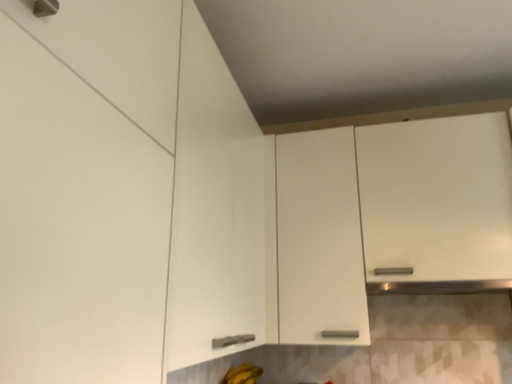
At what (x,y) coordinates should I click in order to perform the action: click on white matte cabinet at upper right, placed as the 1th cabinetry when sorted from right to left. Please return your answer as a coordinate pair (x, y). This screenshot has width=512, height=384. Looking at the image, I should click on (388, 215).

Locate an element on the screen. white matte cabinet at upper right, acting as the 2th cabinetry starting from the left is located at coordinates (388, 215).

Is white matte cabinet at lower left, the second cabinetry in the right-to-left sequence, directly adjacent to yellow matte bananas at lower center?

No, white matte cabinet at lower left, the second cabinetry in the right-to-left sequence, is not making contact with yellow matte bananas at lower center.

Which object is thinner, white matte cabinet at lower left, the 1th cabinetry when ordered from left to right, or yellow matte bananas at lower center?

Thinner between the two is yellow matte bananas at lower center.

Is white matte cabinet at lower left, the second cabinetry in the right-to-left sequence, bigger than yellow matte bananas at lower center?

Yes.

Does white matte cabinet at lower left, the second cabinetry in the right-to-left sequence, have a lesser height compared to yellow matte bananas at lower center?

No, white matte cabinet at lower left, the second cabinetry in the right-to-left sequence, is not shorter than yellow matte bananas at lower center.

Between white matte cabinet at upper right, acting as the 2th cabinetry starting from the left, and yellow matte bananas at lower center, which one has larger width?

Wider between the two is white matte cabinet at upper right, acting as the 2th cabinetry starting from the left.

Considering the relative sizes of white matte cabinet at upper right, placed as the 1th cabinetry when sorted from right to left, and yellow matte bananas at lower center in the image provided, is white matte cabinet at upper right, placed as the 1th cabinetry when sorted from right to left, taller than yellow matte bananas at lower center?

Correct, white matte cabinet at upper right, placed as the 1th cabinetry when sorted from right to left, is much taller as yellow matte bananas at lower center.

From the image's perspective, is white matte cabinet at upper right, acting as the 2th cabinetry starting from the left, below yellow matte bananas at lower center?

No, from the image's perspective, white matte cabinet at upper right, acting as the 2th cabinetry starting from the left, is not below yellow matte bananas at lower center.

Which is closer, [284,319] or [240,375]?

The point [284,319] is closer to the camera.

From the image's perspective, relative to white matte cabinet at upper right, acting as the 2th cabinetry starting from the left, is white matte cabinet at lower left, the second cabinetry in the right-to-left sequence, above or below?

Clearly, from the image's perspective, white matte cabinet at lower left, the second cabinetry in the right-to-left sequence, is above white matte cabinet at upper right, acting as the 2th cabinetry starting from the left.

From a real-world perspective, which is physically below, white matte cabinet at lower left, the second cabinetry in the right-to-left sequence, or white matte cabinet at upper right, acting as the 2th cabinetry starting from the left?

white matte cabinet at lower left, the second cabinetry in the right-to-left sequence, is physically lower.

What's the angular difference between white matte cabinet at lower left, the 1th cabinetry when ordered from left to right, and white matte cabinet at upper right, acting as the 2th cabinetry starting from the left,'s facing directions?

There is a 0.0119-degree angle between the facing directions of white matte cabinet at lower left, the 1th cabinetry when ordered from left to right, and white matte cabinet at upper right, acting as the 2th cabinetry starting from the left.

Considering the relative sizes of white matte cabinet at lower left, the 1th cabinetry when ordered from left to right, and white matte cabinet at upper right, acting as the 2th cabinetry starting from the left, in the image provided, is white matte cabinet at lower left, the 1th cabinetry when ordered from left to right, taller than white matte cabinet at upper right, acting as the 2th cabinetry starting from the left,?

No, white matte cabinet at lower left, the 1th cabinetry when ordered from left to right, is not taller than white matte cabinet at upper right, acting as the 2th cabinetry starting from the left.

Could you tell me if yellow matte bananas at lower center is turned towards white matte cabinet at upper right, acting as the 2th cabinetry starting from the left?

No, yellow matte bananas at lower center is not oriented towards white matte cabinet at upper right, acting as the 2th cabinetry starting from the left.

Is there a large distance between yellow matte bananas at lower center and white matte cabinet at upper right, acting as the 2th cabinetry starting from the left?

No, yellow matte bananas at lower center is not far away from white matte cabinet at upper right, acting as the 2th cabinetry starting from the left.

In the image, is yellow matte bananas at lower center on the left side or the right side of white matte cabinet at upper right, acting as the 2th cabinetry starting from the left?

Clearly, yellow matte bananas at lower center is on the left of white matte cabinet at upper right, acting as the 2th cabinetry starting from the left, in the image.

Is yellow matte bananas at lower center behind white matte cabinet at upper right, acting as the 2th cabinetry starting from the left?

That is True.

Looking at the image, does yellow matte bananas at lower center seem bigger or smaller compared to white matte cabinet at lower left, the second cabinetry in the right-to-left sequence?

yellow matte bananas at lower center is smaller than white matte cabinet at lower left, the second cabinetry in the right-to-left sequence.

Considering the relative positions of yellow matte bananas at lower center and white matte cabinet at lower left, the second cabinetry in the right-to-left sequence, in the image provided, is yellow matte bananas at lower center to the left of white matte cabinet at lower left, the second cabinetry in the right-to-left sequence, from the viewer's perspective?

In fact, yellow matte bananas at lower center is to the right of white matte cabinet at lower left, the second cabinetry in the right-to-left sequence.

Who is taller, yellow matte bananas at lower center or white matte cabinet at lower left, the second cabinetry in the right-to-left sequence?

white matte cabinet at lower left, the second cabinetry in the right-to-left sequence.

Identify the location of the 2nd cabinetry above the yellow matte bananas at lower center (from the image's perspective). This screenshot has width=512, height=384. (86, 188).

How many degrees apart are the facing directions of white matte cabinet at upper right, acting as the 2th cabinetry starting from the left, and white matte cabinet at lower left, the second cabinetry in the right-to-left sequence?

The angle between the facing direction of white matte cabinet at upper right, acting as the 2th cabinetry starting from the left, and the facing direction of white matte cabinet at lower left, the second cabinetry in the right-to-left sequence, is 0.0119 degrees.

Considering the sizes of objects white matte cabinet at upper right, acting as the 2th cabinetry starting from the left, and white matte cabinet at lower left, the second cabinetry in the right-to-left sequence, in the image provided, who is wider, white matte cabinet at upper right, acting as the 2th cabinetry starting from the left, or white matte cabinet at lower left, the second cabinetry in the right-to-left sequence,?

white matte cabinet at lower left, the second cabinetry in the right-to-left sequence.

Is white matte cabinet at lower left, the second cabinetry in the right-to-left sequence, at the back of white matte cabinet at upper right, acting as the 2th cabinetry starting from the left?

No, white matte cabinet at upper right, acting as the 2th cabinetry starting from the left,'s orientation is not away from white matte cabinet at lower left, the second cabinetry in the right-to-left sequence.

Is white matte cabinet at upper right, placed as the 1th cabinetry when sorted from right to left, spatially inside white matte cabinet at lower left, the 1th cabinetry when ordered from left to right, or outside of it?

white matte cabinet at upper right, placed as the 1th cabinetry when sorted from right to left, is not inside white matte cabinet at lower left, the 1th cabinetry when ordered from left to right, it's outside.

Starting from the yellow matte bananas at lower center, which cabinetry is the 2nd one in front? Please provide its 2D coordinates.

[(86, 188)]

Where is `cabinetry on the right side of yellow matte bananas at lower center`? The height and width of the screenshot is (384, 512). cabinetry on the right side of yellow matte bananas at lower center is located at coordinates (388, 215).

Looking at the image, which one is located further to white matte cabinet at lower left, the second cabinetry in the right-to-left sequence, white matte cabinet at upper right, acting as the 2th cabinetry starting from the left, or yellow matte bananas at lower center?

yellow matte bananas at lower center is further to white matte cabinet at lower left, the second cabinetry in the right-to-left sequence.

From the image, which object appears to be nearer to yellow matte bananas at lower center, white matte cabinet at upper right, acting as the 2th cabinetry starting from the left, or white matte cabinet at lower left, the second cabinetry in the right-to-left sequence?

white matte cabinet at upper right, acting as the 2th cabinetry starting from the left, lies closer to yellow matte bananas at lower center than the other object.

Considering their positions, is white matte cabinet at lower left, the 1th cabinetry when ordered from left to right, positioned closer to yellow matte bananas at lower center than white matte cabinet at upper right, placed as the 1th cabinetry when sorted from right to left?

white matte cabinet at upper right, placed as the 1th cabinetry when sorted from right to left, lies closer to yellow matte bananas at lower center than the other object.

Based on their spatial positions, is white matte cabinet at lower left, the 1th cabinetry when ordered from left to right, or yellow matte bananas at lower center further from white matte cabinet at upper right, placed as the 1th cabinetry when sorted from right to left?

white matte cabinet at lower left, the 1th cabinetry when ordered from left to right, is further to white matte cabinet at upper right, placed as the 1th cabinetry when sorted from right to left.

Considering their positions, is yellow matte bananas at lower center positioned closer to white matte cabinet at upper right, acting as the 2th cabinetry starting from the left, than white matte cabinet at lower left, the second cabinetry in the right-to-left sequence?

yellow matte bananas at lower center lies closer to white matte cabinet at upper right, acting as the 2th cabinetry starting from the left, than the other object.

Based on their spatial positions, is yellow matte bananas at lower center or white matte cabinet at upper right, placed as the 1th cabinetry when sorted from right to left, closer to white matte cabinet at lower left, the second cabinetry in the right-to-left sequence?

The object closer to white matte cabinet at lower left, the second cabinetry in the right-to-left sequence, is white matte cabinet at upper right, placed as the 1th cabinetry when sorted from right to left.

Where is `banana situated between white matte cabinet at lower left, the 1th cabinetry when ordered from left to right, and white matte cabinet at upper right, placed as the 1th cabinetry when sorted from right to left, from left to right`? This screenshot has width=512, height=384. banana situated between white matte cabinet at lower left, the 1th cabinetry when ordered from left to right, and white matte cabinet at upper right, placed as the 1th cabinetry when sorted from right to left, from left to right is located at coordinates (243, 374).